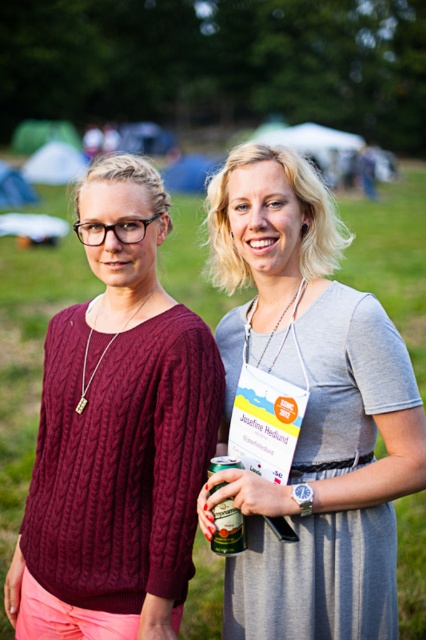
Does point (146, 266) come farther from viewer compared to point (233, 548)?

That is True.

Can you confirm if cable-knit sweater at center is shorter than green matte can at center?

In fact, cable-knit sweater at center may be taller than green matte can at center.

Is point (189, 461) farther from camera compared to point (222, 502)?

That is True.

Locate an element on the screen. This screenshot has height=640, width=426. cable-knit sweater at center is located at coordinates point(117,432).

Can you confirm if gray cotton dress at center is smaller than green matte can at center?

Incorrect, gray cotton dress at center is not smaller in size than green matte can at center.

Does gray cotton dress at center appear on the left side of green matte can at center?

Incorrect, gray cotton dress at center is not on the left side of green matte can at center.

What do you see at coordinates (310, 410) in the screenshot? The height and width of the screenshot is (640, 426). I see `gray cotton dress at center` at bounding box center [310, 410].

In order to click on gray cotton dress at center in this screenshot , I will do `click(310, 410)`.

Can you confirm if gray cotton dress at center is thinner than cable-knit sweater at center?

Yes, gray cotton dress at center is thinner than cable-knit sweater at center.

The width and height of the screenshot is (426, 640). Describe the element at coordinates (310, 410) in the screenshot. I see `gray cotton dress at center` at that location.

Is point (301, 253) farther from viewer compared to point (158, 392)?

Yes, point (301, 253) is farther from viewer.

You are a GUI agent. You are given a task and a screenshot of the screen. Output one action in this format:
    pyautogui.click(x=<x>, y=<y>)
    Task: Click on the gray cotton dress at center
    The height and width of the screenshot is (640, 426).
    Given the screenshot: What is the action you would take?
    310,410